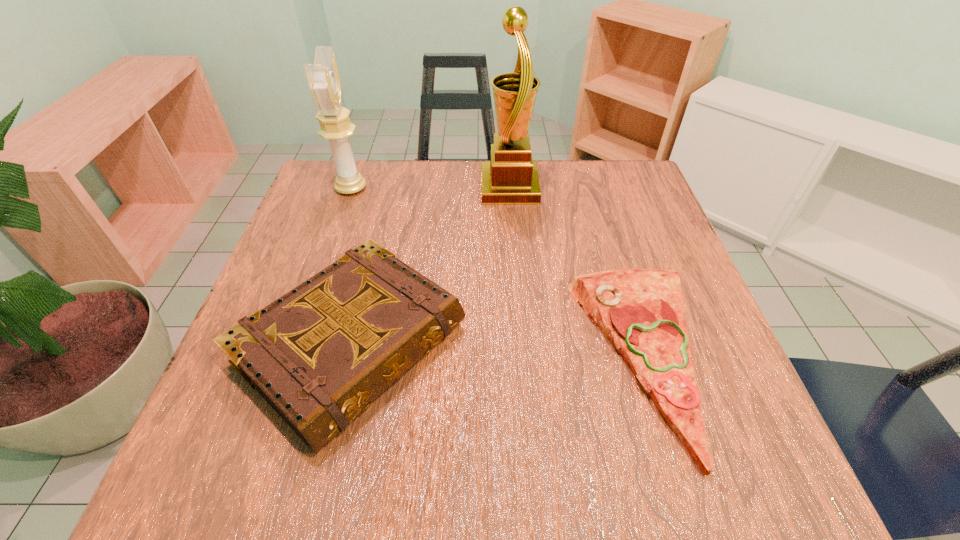
Locate an element on the screen. Image resolution: width=960 pixels, height=540 pixels. free space between the pizza and the tallest object is located at coordinates (576, 273).

At what (x,y) coordinates should I click in order to perform the action: click on empty space that is in between the rightmost object and the right award. Please return your answer as a coordinate pair (x, y). Looking at the image, I should click on (576, 273).

Find the location of a particular element. free space between the shortest object and the third tallest object is located at coordinates (498, 352).

This screenshot has height=540, width=960. I want to click on vacant area that lies between the right award and the shortest object, so click(x=576, y=273).

Find the location of a particular element. Image resolution: width=960 pixels, height=540 pixels. free spot between the taller award and the second shortest object is located at coordinates [431, 266].

The width and height of the screenshot is (960, 540). What are the coordinates of `free space between the pizza and the taller award` in the screenshot? It's located at (576, 273).

Locate an element on the screen. free space between the hardback book and the shortest object is located at coordinates (498, 352).

Find the location of a particular element. free spot between the hardback book and the right award is located at coordinates (431, 266).

Find the location of a particular element. The height and width of the screenshot is (540, 960). object that stands as the second closest to the pizza is located at coordinates (511, 177).

Choose which object is the second nearest neighbor to the hardback book. Please provide its 2D coordinates. Your answer should be formatted as a tuple, i.e. [(x, y)], where the tuple contains the x and y coordinates of a point satisfying the conditions above.

[(511, 177)]